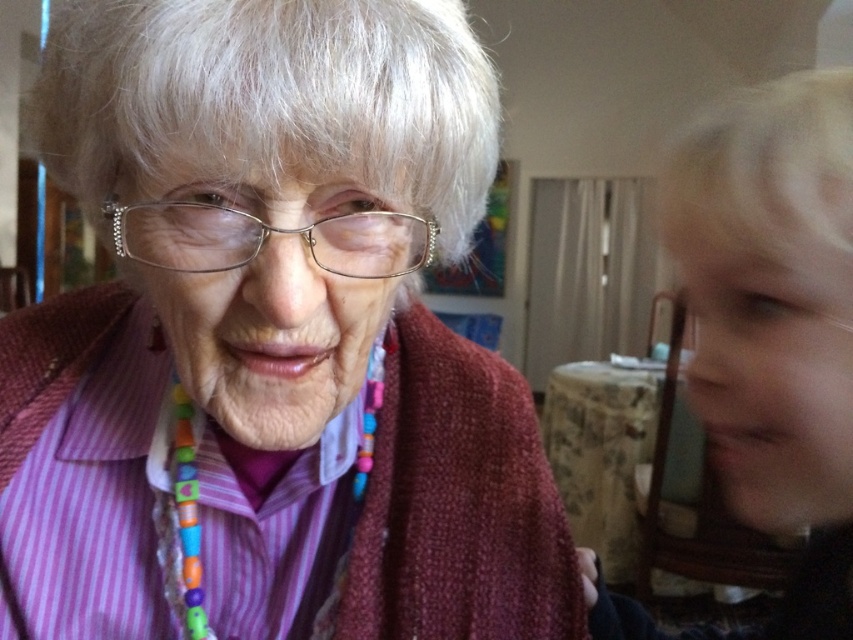
You are standing in the room and see the point at coordinates [271,333]. What object is this point located on?

The point at coordinates [271,333] is located on the matte purple shirt at center.

You are holding a 12 inch ruler and want to measure the distance from your current position to the point marked as point [339,218]. Can you reach it without moving your position?

The distance between point [339,218] and the camera is 13.44 inches. Since the ruler is 12 inches long, you cannot reach the point without moving your position.

Looking at this image, you are organizing a photo shoot and need to ensure that all items in the image are visible. Given that the matte purple shirt at center and the metallic frame glasses at center are both important, which object should be placed closer to the camera to ensure both are fully visible?

The metallic frame glasses at center should be placed closer to the camera because the matte purple shirt at center is taller, so adjusting their positions ensures both objects are fully visible in the photo.